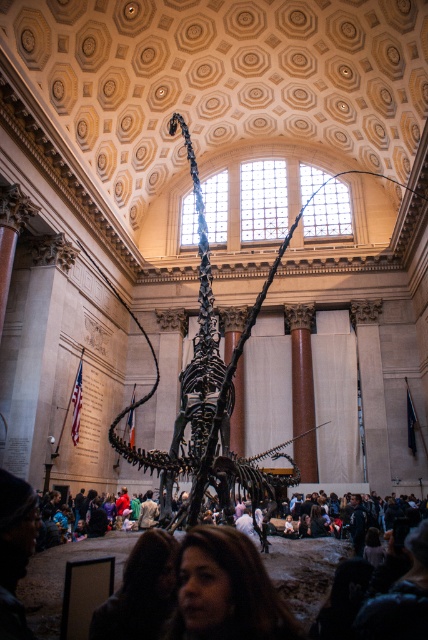
Question: Is shiny metallic dinosaur skeleton at center to the left of dark clothing crowd at center from the viewer's perspective?

Choices:
 (A) no
 (B) yes

Answer: (A)

Question: Which object appears closest to the camera in this image?

Choices:
 (A) dark clothing crowd at center
 (B) shiny metallic dinosaur skeleton at center
 (C) brown hair at lower center

Answer: (C)

Question: Does shiny metallic dinosaur skeleton at center have a smaller size compared to brown hair at lower center?

Choices:
 (A) yes
 (B) no

Answer: (B)

Question: Which point appears closest to the camera in this image?

Choices:
 (A) (183, 547)
 (B) (133, 404)
 (C) (312, 605)

Answer: (A)

Question: Which point is farther to the camera?

Choices:
 (A) (305, 595)
 (B) (241, 332)

Answer: (B)

Question: Does brown hair at lower center appear on the right side of dark clothing crowd at center?

Choices:
 (A) yes
 (B) no

Answer: (A)